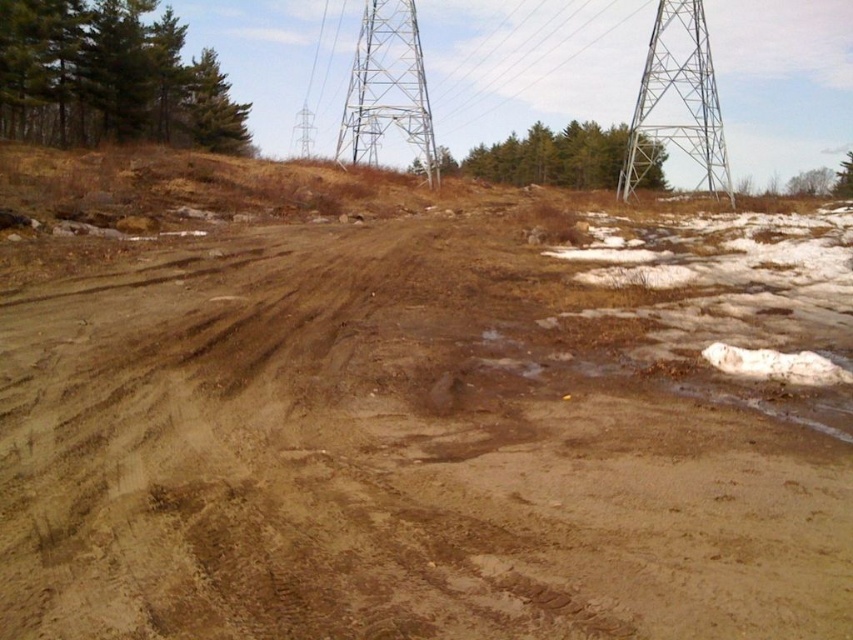
Who is more distant from viewer, (602, 600) or (637, 157)?

The point (637, 157) is more distant.

Does brown dirt field at center have a lesser width compared to metallic silver tower at upper right?

Correct, brown dirt field at center's width is less than metallic silver tower at upper right's.

Where is `brown dirt field at center`? brown dirt field at center is located at coordinates (387, 456).

Between point (376, 141) and point (535, 12), which one is positioned behind?

The point (535, 12) is more distant.

Is point (426, 156) positioned after point (461, 113)?

No, (426, 156) is in front of (461, 113).

Who is more distant from viewer, (x=408, y=138) or (x=561, y=13)?

The point (x=561, y=13) is behind.

This screenshot has width=853, height=640. I want to click on metallic silver tower at upper center, so click(387, 88).

Does brown dirt field at center have a lesser width compared to metallic silver tower at upper center?

Correct, brown dirt field at center's width is less than metallic silver tower at upper center's.

Who is positioned more to the right, brown dirt field at center or metallic silver tower at upper center?

brown dirt field at center

Who is more distant from viewer, (729,472) or (389,81)?

Point (389,81)

The image size is (853, 640). I want to click on brown dirt field at center, so click(387, 456).